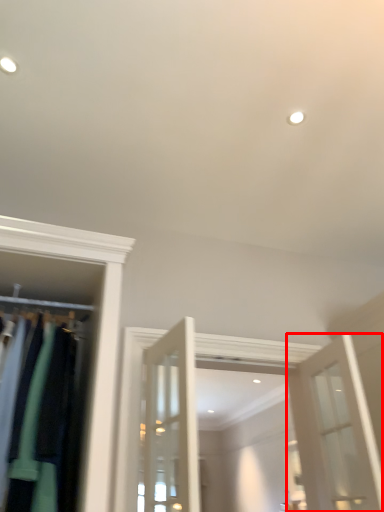
Question: Where is door (annotated by the red box) located in relation to closet in the image?

Choices:
 (A) left
 (B) right

Answer: (B)